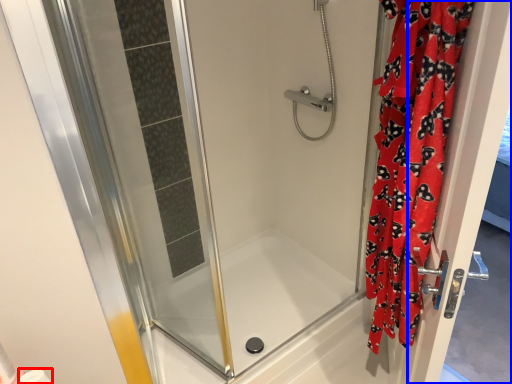
Question: Which object appears farthest to the camera in this image, toilet paper (highlighted by a red box) or screen door (highlighted by a blue box)?

Choices:
 (A) toilet paper
 (B) screen door

Answer: (A)